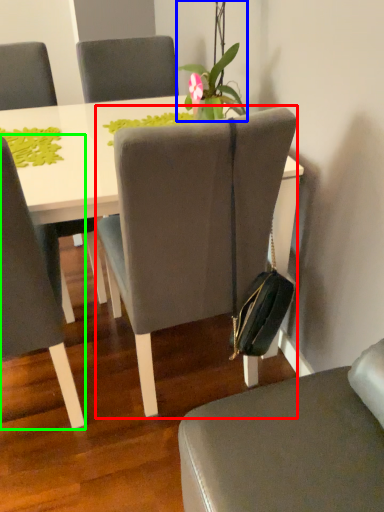
Question: Which object is the farthest from chair (highlighted by a red box)? Choose among these: houseplant (highlighted by a blue box) or chair (highlighted by a green box).

Choices:
 (A) houseplant
 (B) chair

Answer: (A)